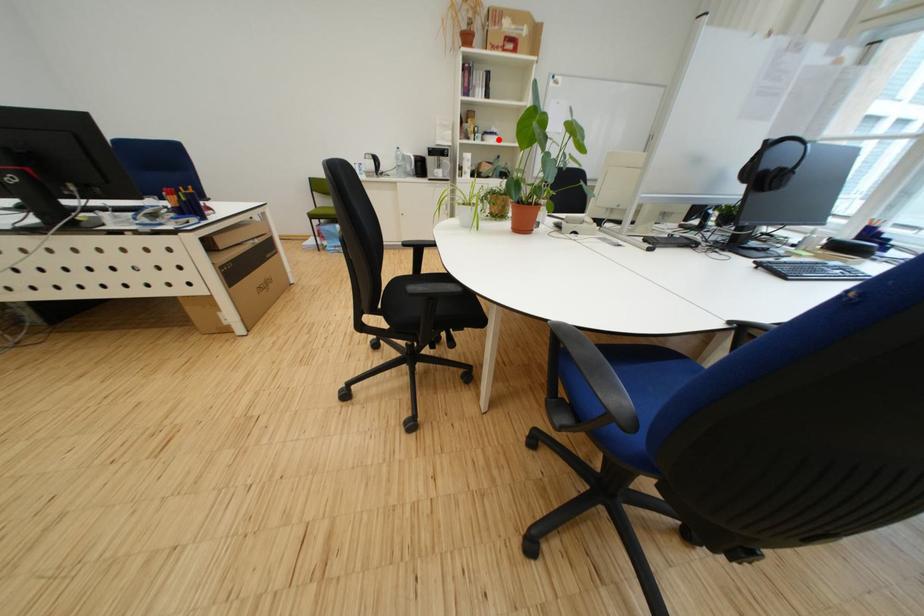
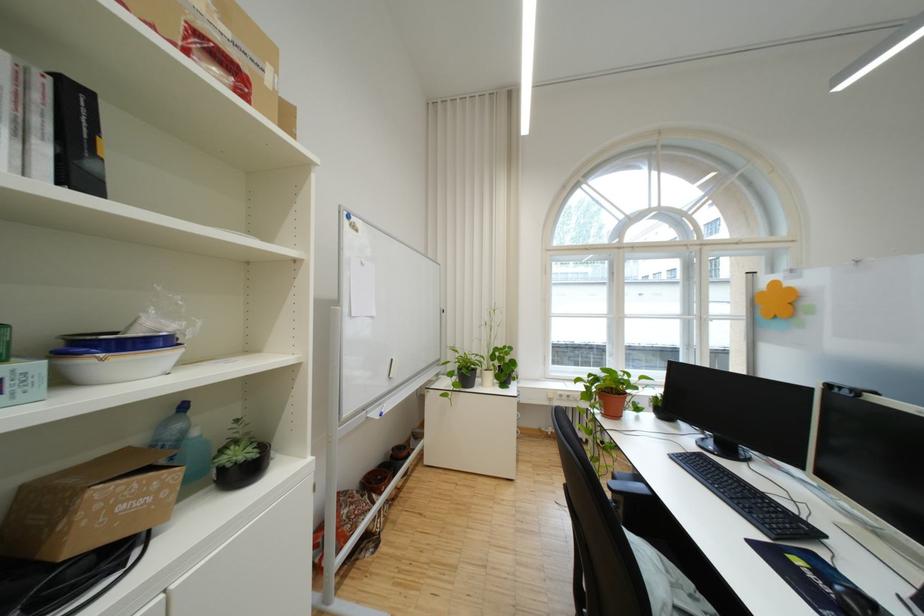
Question: I am providing you with two images of the same scene from different viewpoints. Given a red point in image1, look at the same physical point in image2. Is it:

Choices:
 (A) Closer to the viewpoint
 (B) Farther from the viewpoint

Answer: (B)